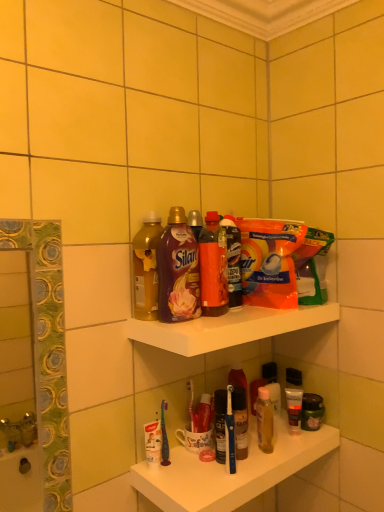
I want to click on free space to the right of matte gold bottle at upper center, positioned as the 1th bottle in left-to-right order, so click(225, 318).